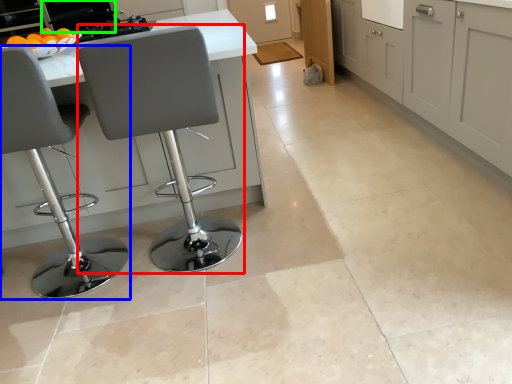
Question: Based on their relative distances, which object is farther from chair (highlighted by a red box)? Choose from chair (highlighted by a blue box) and appliance (highlighted by a green box).

Choices:
 (A) chair
 (B) appliance

Answer: (B)